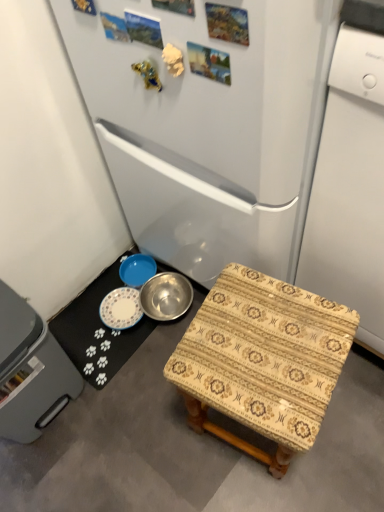
The width and height of the screenshot is (384, 512). I want to click on empty space that is ontop of metallic silver bowl at lower left (from a real-world perspective), so click(x=157, y=405).